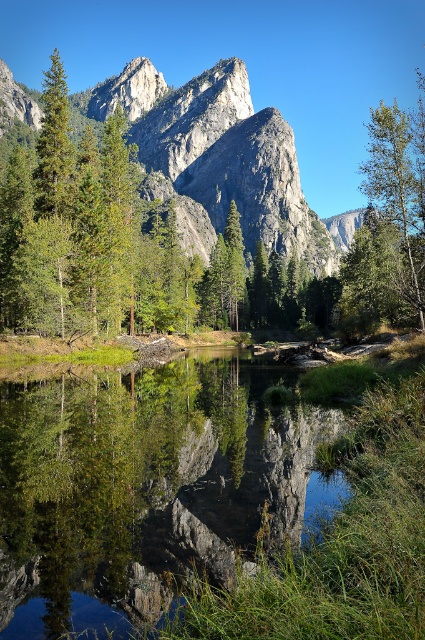
Question: Considering the real-world distances, which object is farthest from the green matte tree at left?

Choices:
 (A) green matte tree at right
 (B) rugged granite mountain at center

Answer: (B)

Question: Which of the following is the closest to the observer?

Choices:
 (A) click(x=119, y=84)
 (B) click(x=53, y=168)
 (C) click(x=404, y=132)

Answer: (B)

Question: Which of these objects is positioned farthest from the rugged granite mountain at center?

Choices:
 (A) green matte tree at right
 (B) green matte tree at left

Answer: (A)

Question: Can you confirm if rugged granite mountain at center is smaller than green matte tree at right?

Choices:
 (A) no
 (B) yes

Answer: (B)

Question: Does green matte tree at right appear on the right side of green matte tree at left?

Choices:
 (A) no
 (B) yes

Answer: (B)

Question: From the image, what is the correct spatial relationship of rugged granite mountain at center in relation to green matte tree at left?

Choices:
 (A) above
 (B) below

Answer: (A)